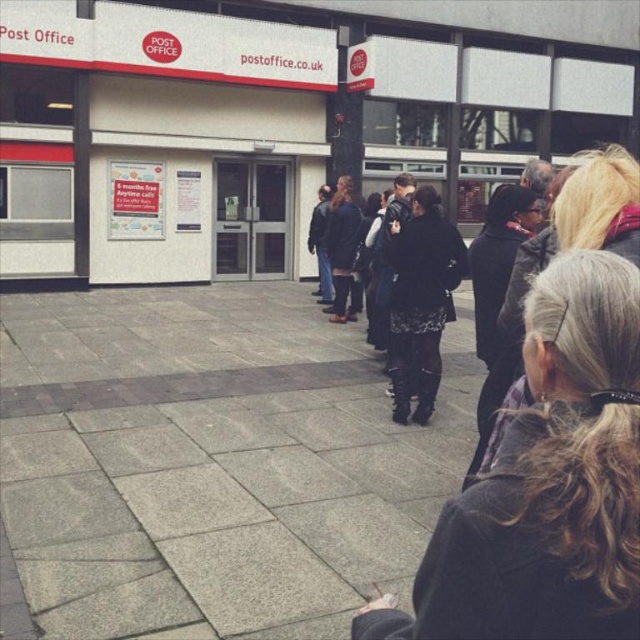
You are standing at the entrance of the Post Office and need to locate the black leather jacket at right. According to the coordinates provided, where exactly is it positioned?

The black leather jacket at right is located at point 0.706 on the x axis and 0.863 on the y axis.

You are a person who wants to borrow a thicker coat from someone in the image. Which of the two coats, the black leather jacket at right or the black textured coat at center, would you ask for?

The black textured coat at center is thicker than the black leather jacket at right, so you should ask for the black textured coat at center.

Looking at this image, you are standing in front of the Post Office and need to determine the location of two points marked in the image. Which of the two points, point 1 at coordinates (564,508) or point 2 at (403,412), is closer to you?

Point 1 at coordinates (564,508) is closer to the viewer than point 2 at (403,412).